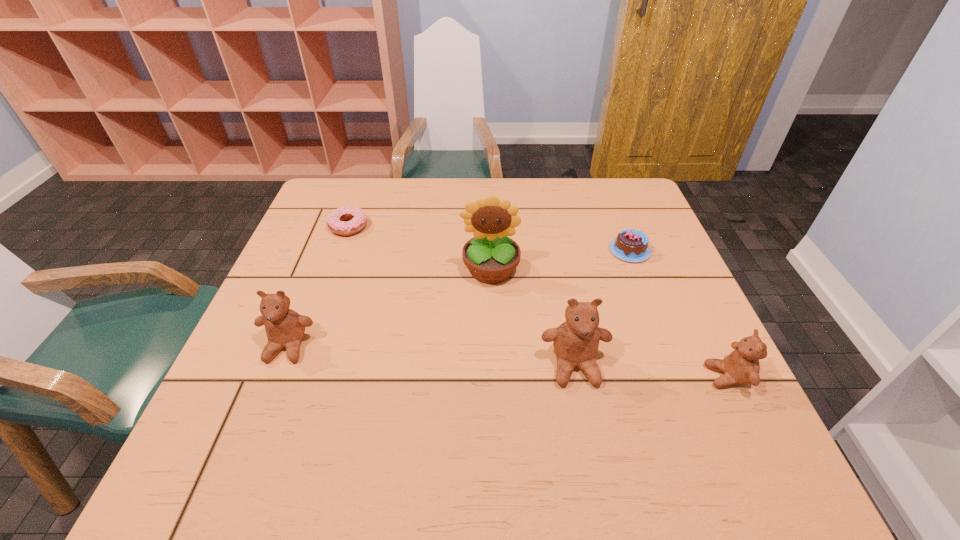
The image size is (960, 540). I want to click on doughnut that is at the left edge, so click(x=358, y=220).

The width and height of the screenshot is (960, 540). Find the location of `teddy bear located at the right edge`. teddy bear located at the right edge is located at coordinates (741, 366).

This screenshot has height=540, width=960. In order to click on chocolate cake that is at the right edge in this screenshot , I will do `click(630, 245)`.

Locate an element on the screen. This screenshot has height=540, width=960. object that is at the far left corner is located at coordinates (358, 220).

This screenshot has width=960, height=540. Identify the location of object that is at the near right corner. (741, 366).

Identify the location of free location at the far edge of the desktop. (381, 183).

Image resolution: width=960 pixels, height=540 pixels. In order to click on vacant space at the near edge in this screenshot , I will do `click(502, 428)`.

At what (x,y) coordinates should I click in order to perform the action: click on vacant space at the left edge. Please return your answer as a coordinate pair (x, y). Looking at the image, I should click on (261, 387).

In the image, there is a desktop. Identify the location of vacant space at the right edge. (625, 289).

I want to click on vacant space at the near left corner of the desktop, so click(238, 408).